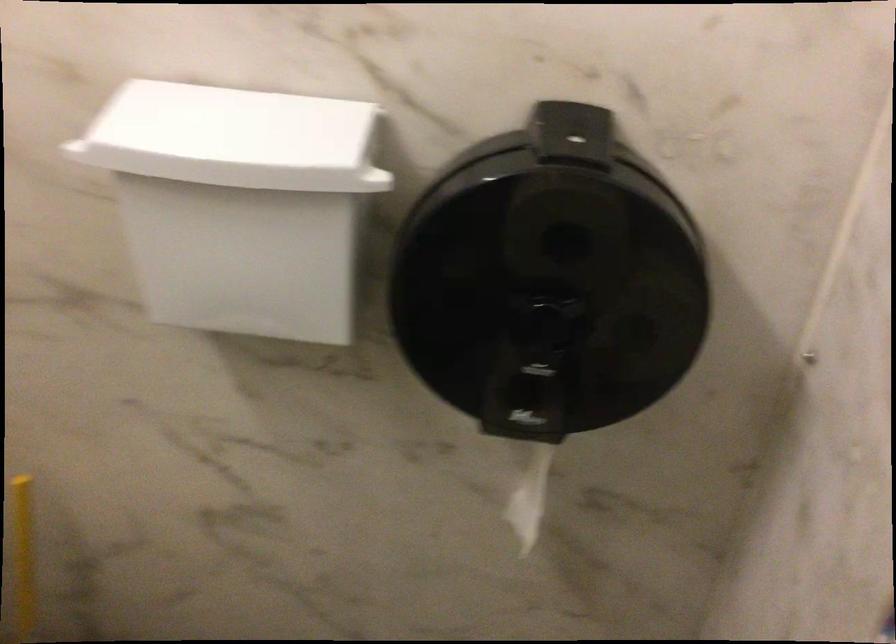
Identify the location of hanging toilet paper. The width and height of the screenshot is (896, 644). (528, 503).